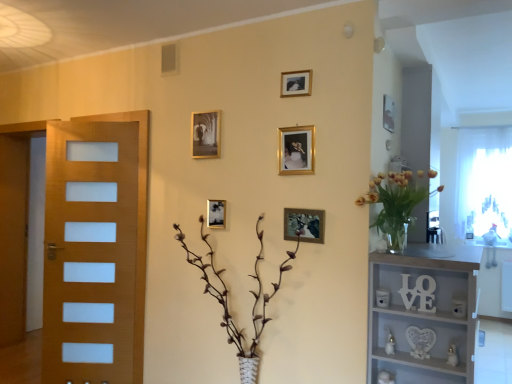
Question: In which direction should I rotate to look at gold metallic picture frame at upper center, arranged as the sixth picture frame when viewed from the left?

Choices:
 (A) right
 (B) left

Answer: (A)

Question: From a real-world perspective, is gold metallic picture frame at upper center, which is the 3th picture frame in right-to-left order, located higher than gold metallic picture frame at center, which is counted as the fifth picture frame, starting from the left?

Choices:
 (A) no
 (B) yes

Answer: (B)

Question: Is the surface of gold metallic picture frame at upper center, which is the 3th picture frame in right-to-left order, in direct contact with gold metallic picture frame at center, which is counted as the fifth picture frame, starting from the left?

Choices:
 (A) yes
 (B) no

Answer: (B)

Question: Is gold metallic picture frame at upper center, which is the 3th picture frame in right-to-left order, positioned in front of gold metallic picture frame at center, which appears as the second picture frame when viewed from the right?

Choices:
 (A) no
 (B) yes

Answer: (A)

Question: Does gold metallic picture frame at upper center, marked as the 4th picture frame in a left-to-right arrangement, turn towards gold metallic picture frame at center, which appears as the second picture frame when viewed from the right?

Choices:
 (A) no
 (B) yes

Answer: (A)

Question: Is gold metallic picture frame at upper center, which is the 3th picture frame in right-to-left order, at the right side of gold metallic picture frame at center, which is counted as the fifth picture frame, starting from the left?

Choices:
 (A) no
 (B) yes

Answer: (A)

Question: Does gold metallic picture frame at upper center, which is the 3th picture frame in right-to-left order, have a larger size compared to gold metallic picture frame at center, which is counted as the fifth picture frame, starting from the left?

Choices:
 (A) yes
 (B) no

Answer: (B)

Question: From a real-world perspective, is brown textured plant at center located higher than metallic gold picture frame at center, arranged as the 5th picture frame when viewed from the right?

Choices:
 (A) no
 (B) yes

Answer: (A)

Question: Can you confirm if brown textured plant at center is taller than metallic gold picture frame at center, arranged as the 5th picture frame when viewed from the right?

Choices:
 (A) no
 (B) yes

Answer: (B)

Question: Does brown textured plant at center touch metallic gold picture frame at center, arranged as the 5th picture frame when viewed from the right?

Choices:
 (A) yes
 (B) no

Answer: (B)

Question: Does brown textured plant at center appear on the left side of metallic gold picture frame at center, arranged as the 5th picture frame when viewed from the right?

Choices:
 (A) yes
 (B) no

Answer: (B)

Question: From the image's perspective, is brown textured plant at center under metallic gold picture frame at center, arranged as the second picture frame when viewed from the left?

Choices:
 (A) yes
 (B) no

Answer: (A)

Question: Does brown textured plant at center have a larger size compared to metallic gold picture frame at center, arranged as the 5th picture frame when viewed from the right?

Choices:
 (A) yes
 (B) no

Answer: (A)

Question: Does brown textured plant at center have a greater width compared to white sheer curtain at right?

Choices:
 (A) yes
 (B) no

Answer: (A)